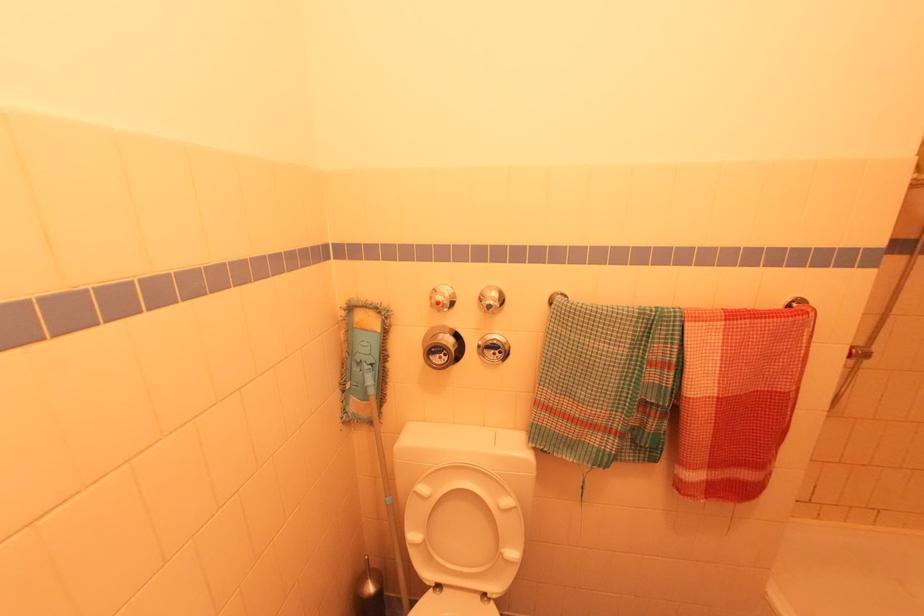
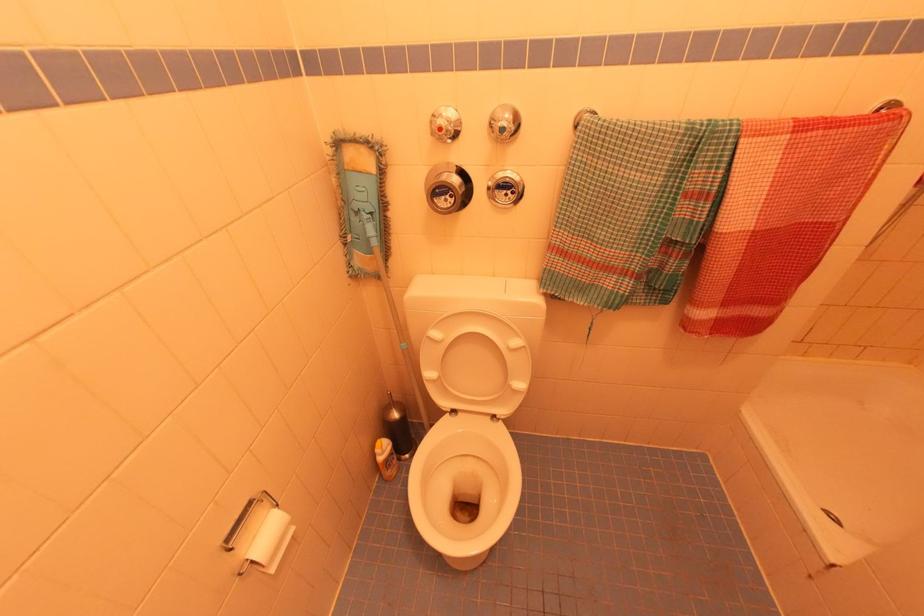
In the second image, find the point that corresponds to [342,392] in the first image.

(344, 246)